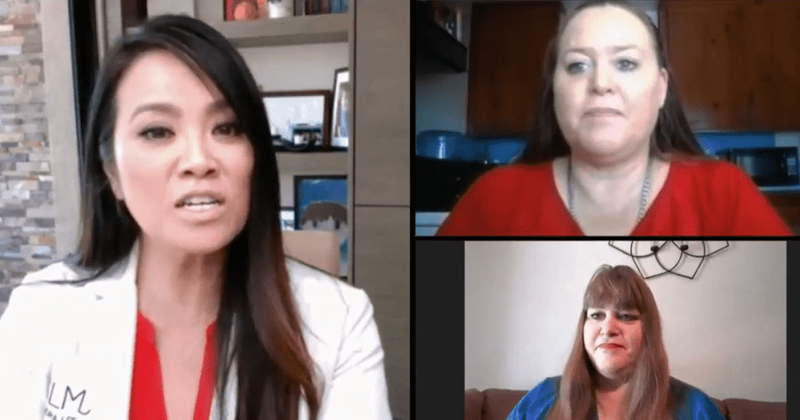
Where is `brown cabinet`? This screenshot has width=800, height=420. brown cabinet is located at coordinates (494, 108), (730, 80).